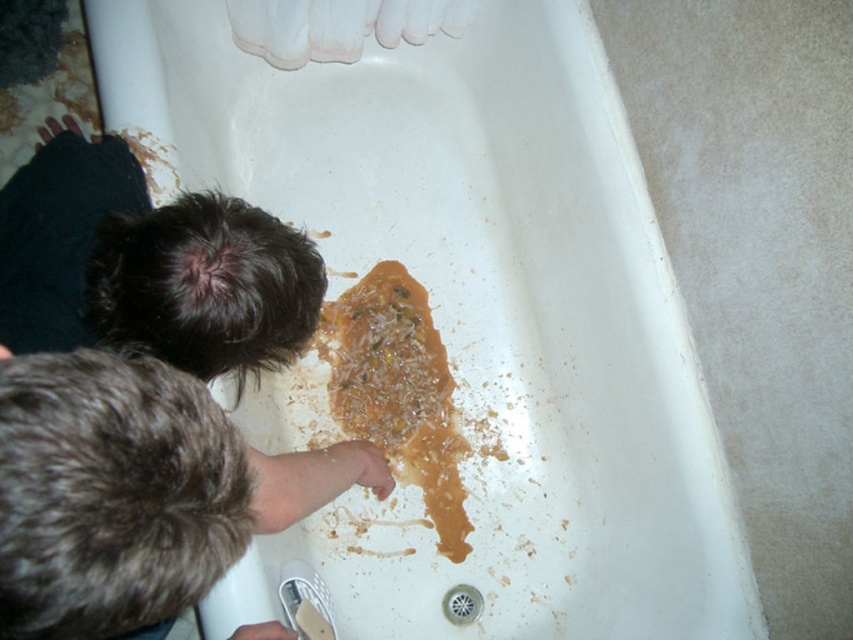
This screenshot has height=640, width=853. Describe the element at coordinates (158, 266) in the screenshot. I see `dark brown fur at upper left` at that location.

Does dark brown fur at upper left have a greater height compared to brown crumbly food at center?

No, dark brown fur at upper left is not taller than brown crumbly food at center.

Does point (144, 333) come closer to viewer compared to point (444, 412)?

Yes, it is in front of point (444, 412).

Locate an element on the screen. The height and width of the screenshot is (640, 853). dark brown fur at upper left is located at coordinates (158, 266).